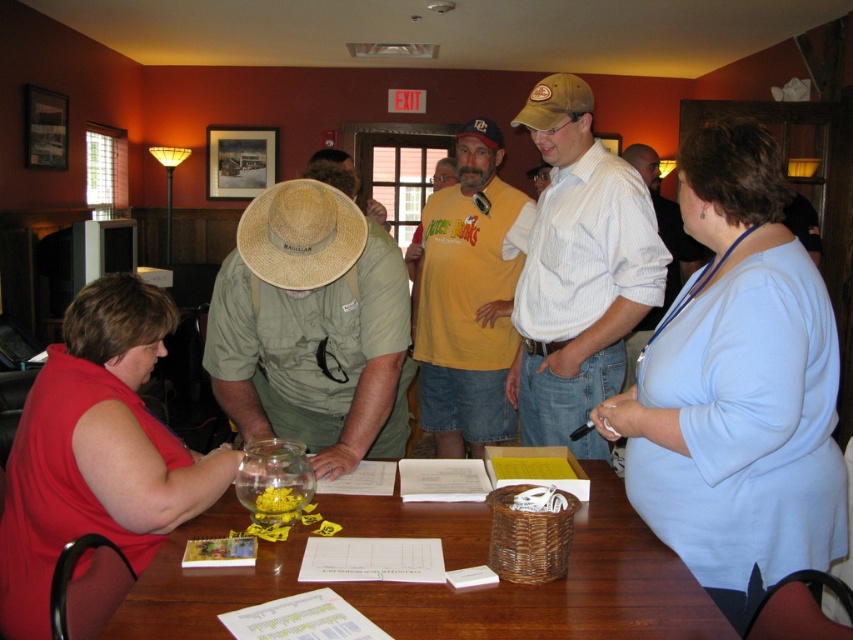
You are organizing a small event and need to place a decorative item on the table. The green canvas hat at center and the matte red blouse at lower left are both candidates. Which item has a larger width, making it more suitable for a centerpiece?

The green canvas hat at center might be wider than matte red blouse at lower left, so it is more suitable for a centerpiece due to its potentially larger width.

You are standing at the point closest to the table. Which of the two points, point (204, 355) or point (57, 388), is farther away from you?

Point (204, 355) is farther away from you because it is behind point (57, 388).

You are a photographer trying to capture a closeup of the khaki cotton hat at center without including the light blue fabric shirt at upper right in the frame. Given their relative widths, is it possible to do so?

The light blue fabric shirt at upper right is wider than the khaki cotton hat at center. Since the shirt is wider, it might be challenging to frame the hat without including the shirt, depending on their positions and angles.